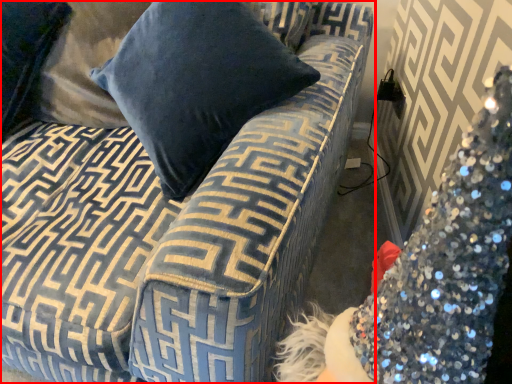
Question: From the image's perspective, where is studio couch (annotated by the red box) located relative to pillow?

Choices:
 (A) above
 (B) below

Answer: (B)